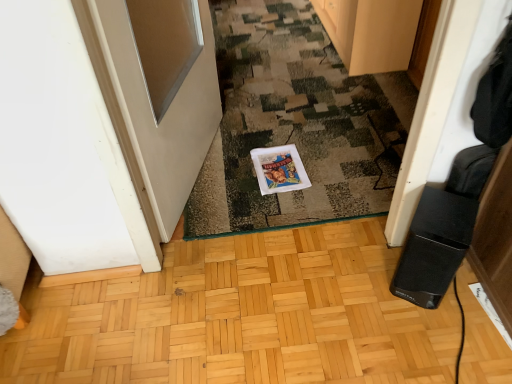
Locate an element on the screen. Image resolution: width=512 pixels, height=384 pixels. vacant area that is in front of black plastic speaker at lower right is located at coordinates (438, 332).